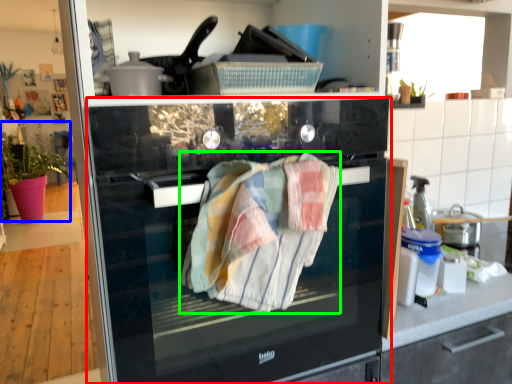
Question: Which object is positioned farthest from home appliance (highlighted by a red box)? Select from plant (highlighted by a blue box) and bath towel (highlighted by a green box).

Choices:
 (A) plant
 (B) bath towel

Answer: (A)